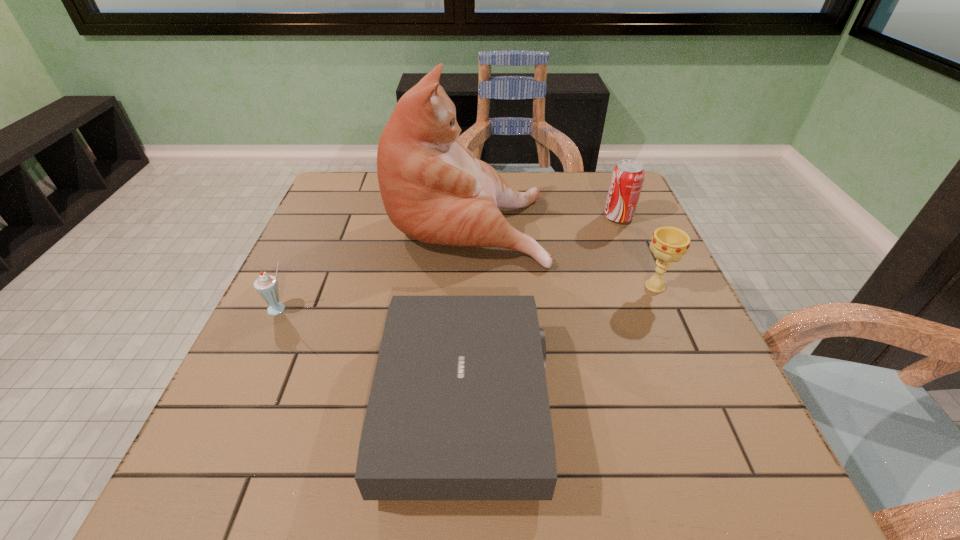
This screenshot has height=540, width=960. In order to click on free space that is in between the nearest object and the second nearest object in this screenshot , I will do `click(372, 357)`.

You are a GUI agent. You are given a task and a screenshot of the screen. Output one action in this format:
    pyautogui.click(x=<x>, y=<y>)
    Task: Click on the unoccupied position between the fourth farthest object and the tallest object
    The width and height of the screenshot is (960, 540).
    Given the screenshot: What is the action you would take?
    pyautogui.click(x=373, y=265)

Find the location of `vacant point located between the soda can and the second nearest object`. vacant point located between the soda can and the second nearest object is located at coordinates (449, 263).

Locate which object ranks in proximity to the soda can. Please provide its 2D coordinates. Your answer should be formatted as a tuple, i.e. [(x, y)], where the tuple contains the x and y coordinates of a point satisfying the conditions above.

[(434, 189)]

Locate which object ranks in proximity to the leftmost object. Please provide its 2D coordinates. Your answer should be formatted as a tuple, i.e. [(x, y)], where the tuple contains the x and y coordinates of a point satisfying the conditions above.

[(434, 189)]

Where is `vacant space that satisfies the following two spatial constraints: 1. on the face of the chalice; 2. on the right side of the cat`? vacant space that satisfies the following two spatial constraints: 1. on the face of the chalice; 2. on the right side of the cat is located at coordinates (464, 286).

Where is `vacant space that satisfies the following two spatial constraints: 1. on the front side of the third farthest object; 2. on the front-facing side of the nearest object`? The width and height of the screenshot is (960, 540). vacant space that satisfies the following two spatial constraints: 1. on the front side of the third farthest object; 2. on the front-facing side of the nearest object is located at coordinates (706, 404).

Locate an element on the screen. This screenshot has width=960, height=540. free spot that satisfies the following two spatial constraints: 1. on the logo side of the third farthest object; 2. on the right side of the soda can is located at coordinates (646, 286).

The height and width of the screenshot is (540, 960). Identify the location of vacant space that satisfies the following two spatial constraints: 1. on the face of the tallest object; 2. on the left side of the third farthest object. (464, 286).

This screenshot has width=960, height=540. Find the location of `vacant space that satisfies the following two spatial constraints: 1. on the back side of the chalice; 2. on the logo side of the soda can`. vacant space that satisfies the following two spatial constraints: 1. on the back side of the chalice; 2. on the logo side of the soda can is located at coordinates (625, 217).